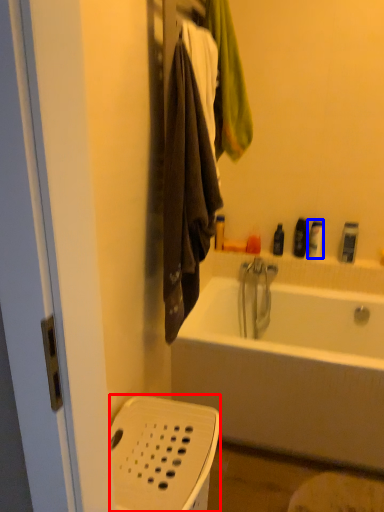
Question: Among these objects, which one is nearest to the camera, basket (highlighted by a red box) or toiletry (highlighted by a blue box)?

Choices:
 (A) basket
 (B) toiletry

Answer: (A)